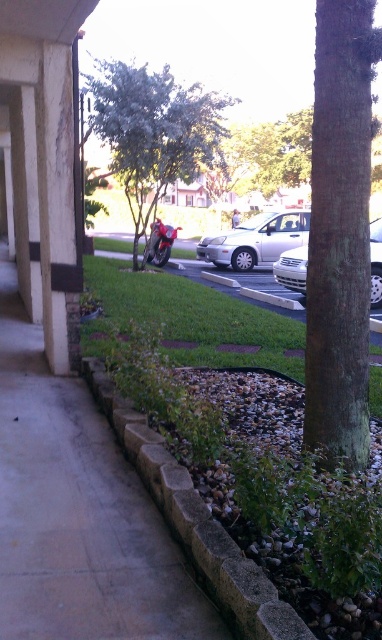
Can you confirm if green rough bark tree at right is bigger than shiny red motorcycle at center?

Yes, green rough bark tree at right is bigger than shiny red motorcycle at center.

Can you confirm if green rough bark tree at right is positioned above shiny red motorcycle at center?

No.

The image size is (382, 640). Identify the location of green rough bark tree at right. (339, 232).

Can you confirm if satin silver car at center is shorter than shiny red motorcycle at center?

In fact, satin silver car at center may be taller than shiny red motorcycle at center.

Is satin silver car at center bigger than shiny red motorcycle at center?

Correct, satin silver car at center is larger in size than shiny red motorcycle at center.

The height and width of the screenshot is (640, 382). What do you see at coordinates (255, 240) in the screenshot?
I see `satin silver car at center` at bounding box center [255, 240].

This screenshot has height=640, width=382. I want to click on satin silver car at center, so tap(255, 240).

Is point (98, 429) farther from camera compared to point (294, 352)?

That is False.

Who is taller, brown concrete pavement at center or green grass at center?

Standing taller between the two is green grass at center.

I want to click on brown concrete pavement at center, so click(77, 513).

The height and width of the screenshot is (640, 382). I want to click on brown concrete pavement at center, so click(x=77, y=513).